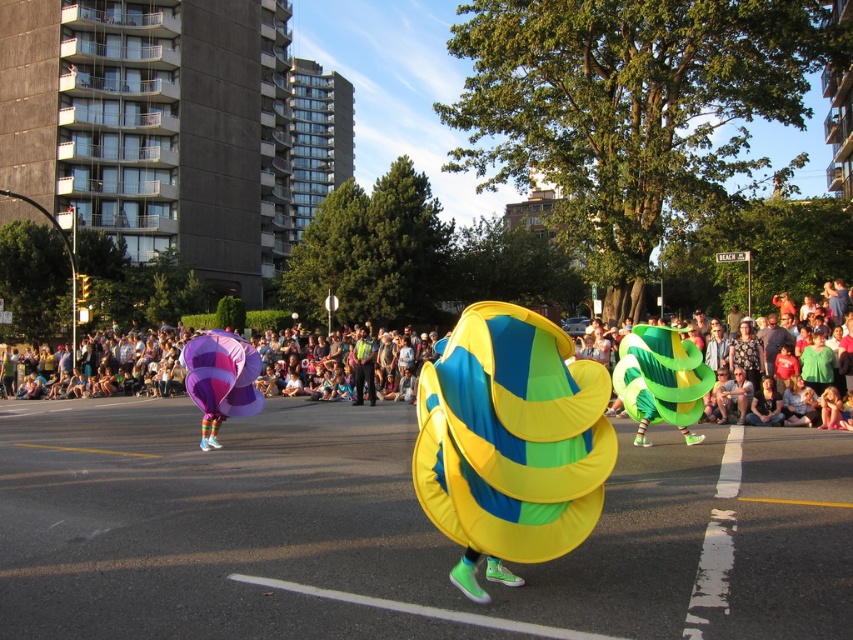
You are an event organizer planning to place a new banner between the shiny yellow fabric at center and the matte plastic crowd at center. Given their spatial relationship, which object should the banner be closer to?

The shiny yellow fabric at center occupies less space than the matte plastic crowd at center, so the banner should be placed closer to the shiny yellow fabric at center to balance the visual weight.

You are a photographer standing on the street during the parade. You want to capture a photo of the green matte balloon at center without any people in the frame. Based on the scene description, is it possible to position yourself in a way that the matte plastic crowd at center doesn

The matte plastic crowd at center is to the left of the green matte balloon at center, so if you position yourself to the right side of the balloon, you might be able to avoid the crowd and capture the balloon without people in the frame.